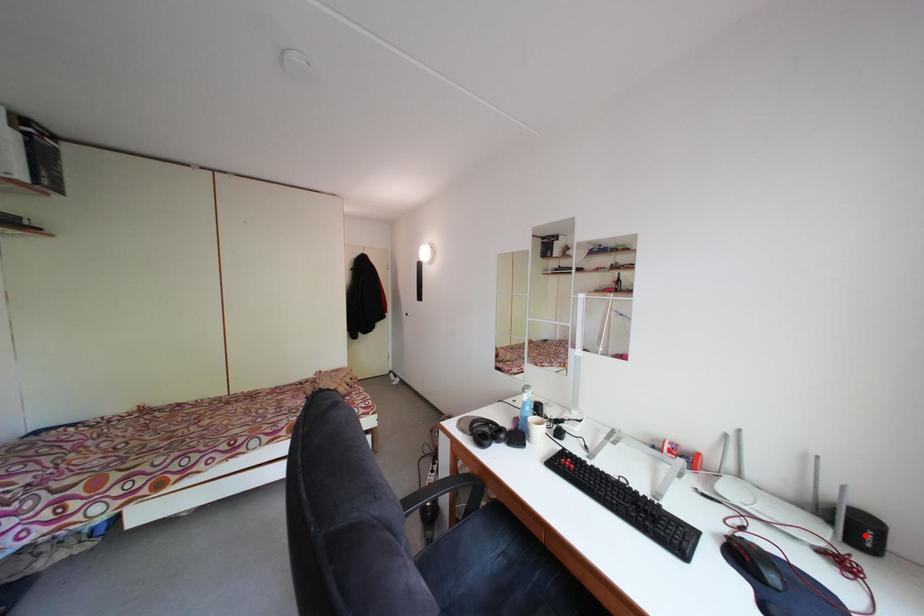
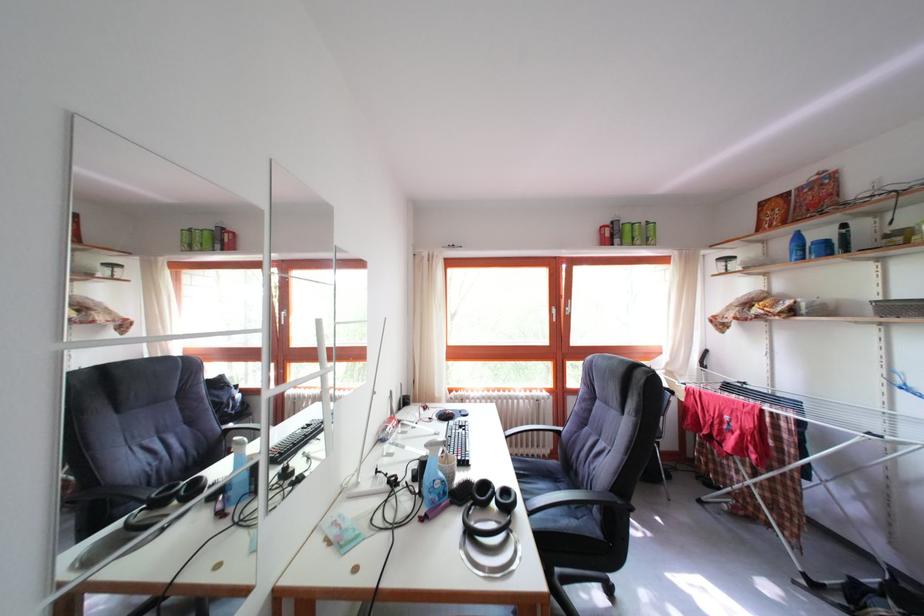
Question: I am providing you with two images of the same scene from different viewpoints. A red point is marked on the first image. Can you still see the location of the red point in image 2?

Choices:
 (A) Yes
 (B) No

Answer: (B)